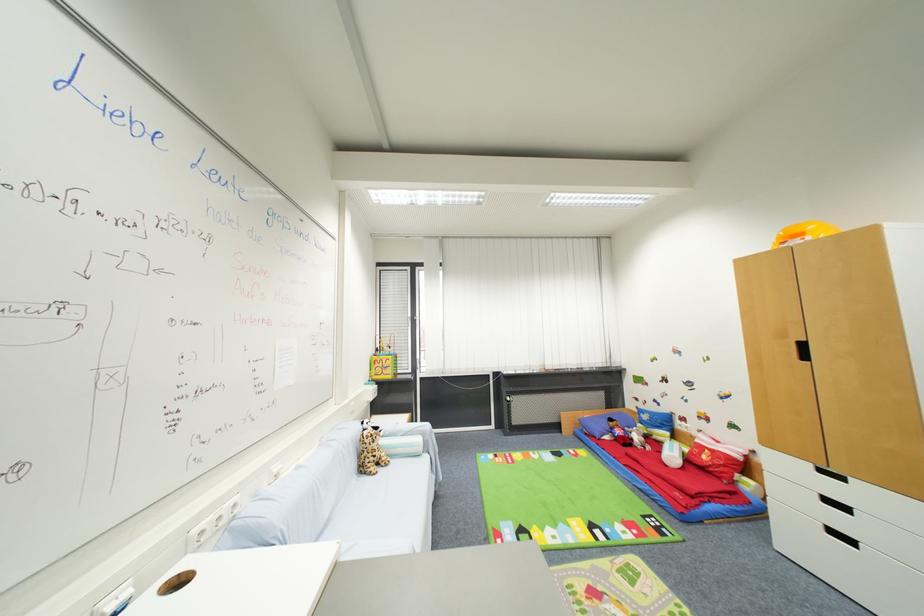
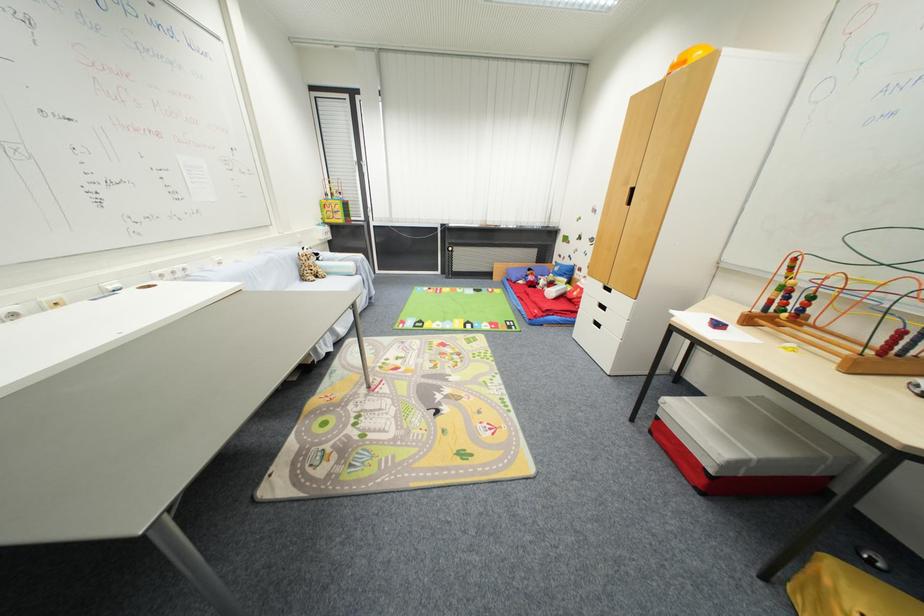
The point at (x=816, y=467) is marked in the first image. Where is the corresponding point in the second image?

(606, 286)